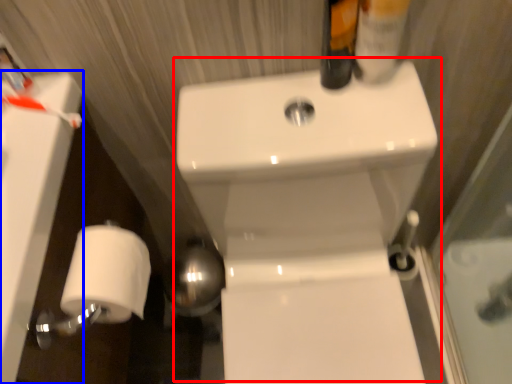
Question: Which point is further to the camera, sink (highlighted by a red box) or bath (highlighted by a blue box)?

Choices:
 (A) sink
 (B) bath

Answer: (B)